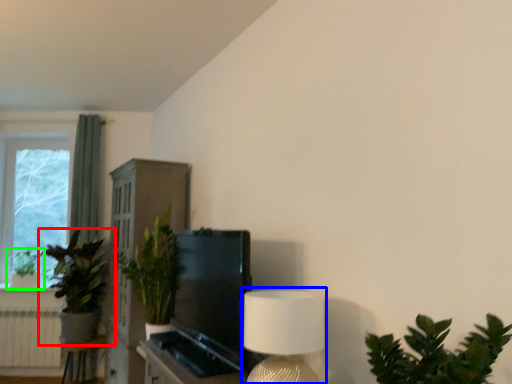
Question: Based on their relative distances, which object is farther from houseplant (highlighted by a red box)? Choose from table lamp (highlighted by a blue box) and houseplant (highlighted by a green box).

Choices:
 (A) table lamp
 (B) houseplant

Answer: (A)